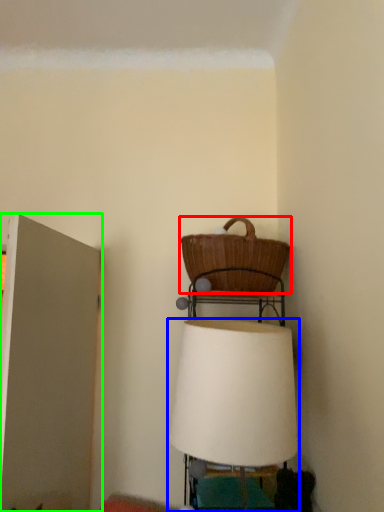
Question: Considering the real-world distances, which object is closest to picnic basket (highlighted by a red box)? lamp (highlighted by a blue box) or door (highlighted by a green box).

Choices:
 (A) lamp
 (B) door

Answer: (A)